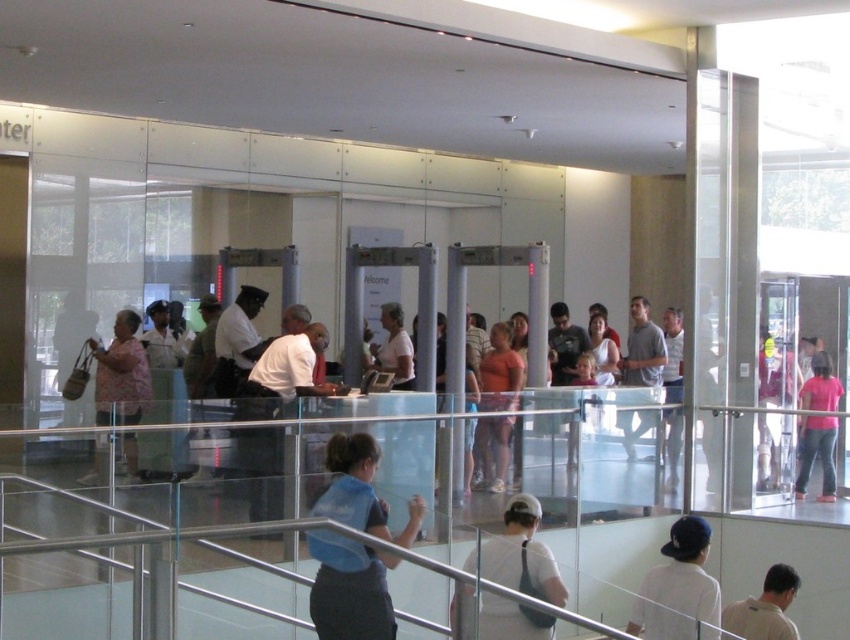
Looking at this image, you are standing at the security checkpoint and want to reach the two points marked in the image. Which point, point (503, 563) or point (820, 365), is closer to you?

Point (503, 563) is closer to the viewer than point (820, 365).

You are standing at the security checkpoint and want to move towards the staircase. There are two points marked as point (673, 632) and point (633, 435). Which point should you head towards to reach the staircase first?

Point (673, 632) is in front of point (633, 435), so you should head towards point (673, 632) to reach the staircase first.